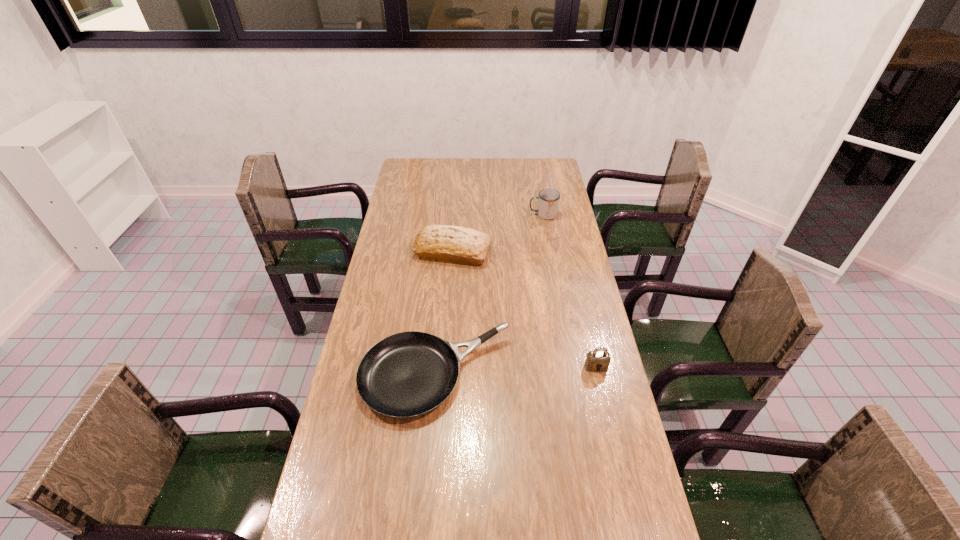
The height and width of the screenshot is (540, 960). In order to click on free space between the bread and the padlock in this screenshot , I will do `click(524, 309)`.

The width and height of the screenshot is (960, 540). I want to click on vacant space that's between the mug and the pan, so click(x=490, y=295).

Identify the location of empty space that is in between the farthest object and the padlock. (569, 291).

At what (x,y) coordinates should I click in order to perform the action: click on vacant area between the padlock and the bread. Please return your answer as a coordinate pair (x, y). This screenshot has height=540, width=960. Looking at the image, I should click on (524, 309).

Locate an element on the screen. This screenshot has width=960, height=540. blank region between the farthest object and the shortest object is located at coordinates (490, 295).

Where is `free space between the pan and the bread`? The height and width of the screenshot is (540, 960). free space between the pan and the bread is located at coordinates (444, 314).

This screenshot has height=540, width=960. In order to click on unoccupied area between the second farthest object and the padlock in this screenshot , I will do `click(524, 309)`.

Where is `free space between the shortest object and the padlock`? The height and width of the screenshot is (540, 960). free space between the shortest object and the padlock is located at coordinates (516, 372).

This screenshot has height=540, width=960. In order to click on free space between the pan and the mug in this screenshot , I will do coord(490,295).

I want to click on the closest object to the farthest object, so click(453, 244).